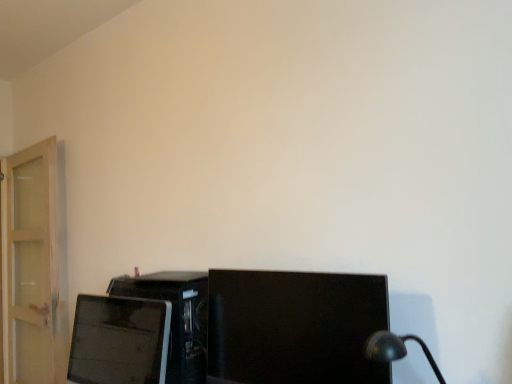
Where is `black glossy monitor at center, arranged as the 2th computer monitor when viewed from the left`? black glossy monitor at center, arranged as the 2th computer monitor when viewed from the left is located at coordinates (294, 327).

Where is `black glossy monitor at center, which appears as the first computer monitor when viewed from the right`? black glossy monitor at center, which appears as the first computer monitor when viewed from the right is located at coordinates (294, 327).

Consider the image. Is black glossy monitor at center, which appears as the first computer monitor when viewed from the right, at the left side of matte black desktop computer at lower left?

No.

How different are the orientations of black glossy monitor at center, arranged as the 2th computer monitor when viewed from the left, and matte black desktop computer at lower left in degrees?

The angle between the facing direction of black glossy monitor at center, arranged as the 2th computer monitor when viewed from the left, and the facing direction of matte black desktop computer at lower left is 1.14 degrees.

Could matte black desktop computer at lower left be considered to be inside black glossy monitor at center, which appears as the first computer monitor when viewed from the right?

No, matte black desktop computer at lower left is not surrounded by black glossy monitor at center, which appears as the first computer monitor when viewed from the right.

Consider the image. Are black glossy monitor at center, which appears as the first computer monitor when viewed from the right, and matte black desktop computer at lower left far apart?

No.

Is the depth of matte black monitor at lower left, marked as the 1th computer monitor in a left-to-right arrangement, greater than that of matte black desktop computer at lower left?

No, matte black monitor at lower left, marked as the 1th computer monitor in a left-to-right arrangement, is in front of matte black desktop computer at lower left.

From the picture: Is matte black monitor at lower left, which is counted as the 2th computer monitor, starting from the right, completely or partially outside of matte black desktop computer at lower left?

Yes.

Who is taller, matte black monitor at lower left, marked as the 1th computer monitor in a left-to-right arrangement, or matte black desktop computer at lower left?

With more height is matte black desktop computer at lower left.

Which is more to the left, matte black desktop computer at lower left or matte black monitor at lower left, which is counted as the 2th computer monitor, starting from the right?

From the viewer's perspective, matte black monitor at lower left, which is counted as the 2th computer monitor, starting from the right, appears more on the left side.

Is matte black monitor at lower left, which is counted as the 2th computer monitor, starting from the right, surrounded by matte black desktop computer at lower left?

That's incorrect, matte black monitor at lower left, which is counted as the 2th computer monitor, starting from the right, is not inside matte black desktop computer at lower left.

Considering the relative sizes of matte black desktop computer at lower left and matte black monitor at lower left, which is counted as the 2th computer monitor, starting from the right, in the image provided, is matte black desktop computer at lower left taller than matte black monitor at lower left, which is counted as the 2th computer monitor, starting from the right,?

Indeed, matte black desktop computer at lower left has a greater height compared to matte black monitor at lower left, which is counted as the 2th computer monitor, starting from the right.

Looking at this image, from a real-world perspective, between matte black desktop computer at lower left and matte black monitor at lower left, which is counted as the 2th computer monitor, starting from the right, who is vertically lower?

matte black desktop computer at lower left, from a real-world perspective.

Which object is positioned more to the right, black glossy monitor at center, arranged as the 2th computer monitor when viewed from the left, or matte black monitor at lower left, marked as the 1th computer monitor in a left-to-right arrangement?

black glossy monitor at center, arranged as the 2th computer monitor when viewed from the left, is more to the right.

Considering the sizes of black glossy monitor at center, which appears as the first computer monitor when viewed from the right, and matte black monitor at lower left, which is counted as the 2th computer monitor, starting from the right, in the image, is black glossy monitor at center, which appears as the first computer monitor when viewed from the right, wider or thinner than matte black monitor at lower left, which is counted as the 2th computer monitor, starting from the right,?

In the image, black glossy monitor at center, which appears as the first computer monitor when viewed from the right, appears to be wider than matte black monitor at lower left, which is counted as the 2th computer monitor, starting from the right.

Considering the positions of points (276, 369) and (151, 310), is point (276, 369) farther from camera compared to point (151, 310)?

No.

Identify the location of computer monitor on the right side of matte black monitor at lower left, which is counted as the 2th computer monitor, starting from the right. (294, 327).

From the image's perspective, which one is positioned lower, matte black desktop computer at lower left or black glossy monitor at center, which appears as the first computer monitor when viewed from the right?

From the image's view, matte black desktop computer at lower left is below.

Are matte black desktop computer at lower left and black glossy monitor at center, arranged as the 2th computer monitor when viewed from the left, making contact?

No.

Is black glossy monitor at center, which appears as the first computer monitor when viewed from the right, located within matte black desktop computer at lower left?

No, matte black desktop computer at lower left does not contain black glossy monitor at center, which appears as the first computer monitor when viewed from the right.

Can you confirm if matte black monitor at lower left, marked as the 1th computer monitor in a left-to-right arrangement, is thinner than black glossy monitor at center, which appears as the first computer monitor when viewed from the right?

Yes, matte black monitor at lower left, marked as the 1th computer monitor in a left-to-right arrangement, is thinner than black glossy monitor at center, which appears as the first computer monitor when viewed from the right.

Is matte black monitor at lower left, marked as the 1th computer monitor in a left-to-right arrangement, aimed at black glossy monitor at center, which appears as the first computer monitor when viewed from the right?

No, matte black monitor at lower left, marked as the 1th computer monitor in a left-to-right arrangement, is not oriented towards black glossy monitor at center, which appears as the first computer monitor when viewed from the right.

Is matte black monitor at lower left, marked as the 1th computer monitor in a left-to-right arrangement, surrounding black glossy monitor at center, arranged as the 2th computer monitor when viewed from the left?

Definitely not — black glossy monitor at center, arranged as the 2th computer monitor when viewed from the left, is not inside matte black monitor at lower left, marked as the 1th computer monitor in a left-to-right arrangement.

You are a GUI agent. You are given a task and a screenshot of the screen. Output one action in this format:
    pyautogui.click(x=<x>, y=<y>)
    Task: Click on the desktop computer that is on the left side of black glossy monitor at center, arranged as the 2th computer monitor when viewed from the left
    The height and width of the screenshot is (384, 512).
    Given the screenshot: What is the action you would take?
    pyautogui.click(x=176, y=317)

The image size is (512, 384). In order to click on desktop computer that is on the right side of matte black monitor at lower left, which is counted as the 2th computer monitor, starting from the right in this screenshot , I will do click(176, 317).

Looking at the image, which one is located closer to black glossy monitor at center, which appears as the first computer monitor when viewed from the right, matte black monitor at lower left, which is counted as the 2th computer monitor, starting from the right, or matte black desktop computer at lower left?

matte black desktop computer at lower left is positioned closer to the anchor black glossy monitor at center, which appears as the first computer monitor when viewed from the right.

Looking at the image, which one is located closer to matte black monitor at lower left, marked as the 1th computer monitor in a left-to-right arrangement, black glossy monitor at center, arranged as the 2th computer monitor when viewed from the left, or matte black desktop computer at lower left?

Among the two, matte black desktop computer at lower left is located nearer to matte black monitor at lower left, marked as the 1th computer monitor in a left-to-right arrangement.

Estimate the real-world distances between objects in this image. Which object is closer to matte black monitor at lower left, marked as the 1th computer monitor in a left-to-right arrangement, matte black desktop computer at lower left or black glossy monitor at center, which appears as the first computer monitor when viewed from the right?

The object closer to matte black monitor at lower left, marked as the 1th computer monitor in a left-to-right arrangement, is matte black desktop computer at lower left.

From the image, which object appears to be nearer to matte black desktop computer at lower left, matte black monitor at lower left, which is counted as the 2th computer monitor, starting from the right, or black glossy monitor at center, which appears as the first computer monitor when viewed from the right?

The object closer to matte black desktop computer at lower left is matte black monitor at lower left, which is counted as the 2th computer monitor, starting from the right.

Looking at the image, which one is located closer to matte black desktop computer at lower left, black glossy monitor at center, which appears as the first computer monitor when viewed from the right, or matte black monitor at lower left, marked as the 1th computer monitor in a left-to-right arrangement?

Based on the image, matte black monitor at lower left, marked as the 1th computer monitor in a left-to-right arrangement, appears to be nearer to matte black desktop computer at lower left.

Looking at the image, which one is located further to black glossy monitor at center, which appears as the first computer monitor when viewed from the right, matte black desktop computer at lower left or matte black monitor at lower left, marked as the 1th computer monitor in a left-to-right arrangement?

matte black monitor at lower left, marked as the 1th computer monitor in a left-to-right arrangement, is positioned further to the anchor black glossy monitor at center, which appears as the first computer monitor when viewed from the right.

In order to click on desktop computer between matte black monitor at lower left, marked as the 1th computer monitor in a left-to-right arrangement, and black glossy monitor at center, arranged as the 2th computer monitor when viewed from the left, in the horizontal direction in this screenshot , I will do `click(176, 317)`.